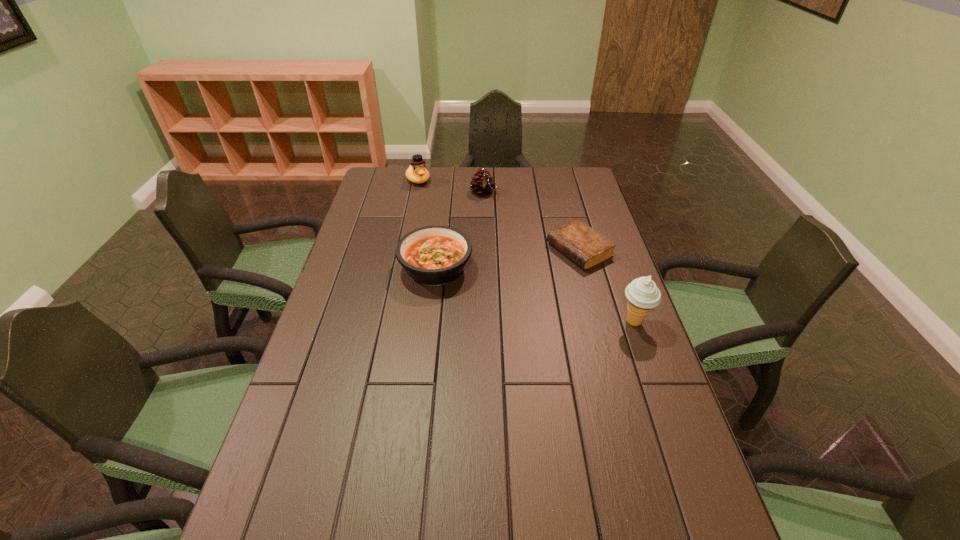
Image resolution: width=960 pixels, height=540 pixels. What are the coordinates of `icecream that is at the right edge` in the screenshot? It's located at (642, 293).

Locate an element on the screen. diary situated at the right edge is located at coordinates (586, 247).

Where is `object present at the far left corner`? object present at the far left corner is located at coordinates (416, 173).

Find the location of a particular element. The image size is (960, 540). vacant region at the far edge of the desktop is located at coordinates (462, 173).

Where is `vacant area at the left edge of the desktop`? vacant area at the left edge of the desktop is located at coordinates (290, 411).

I want to click on vacant space at the right edge, so click(642, 401).

This screenshot has width=960, height=540. What are the coordinates of `vacant space at the far left corner of the desktop` in the screenshot? It's located at (366, 191).

The height and width of the screenshot is (540, 960). What are the coordinates of `blank area at the far right corner` in the screenshot? It's located at (553, 188).

This screenshot has width=960, height=540. What are the coordinates of `vacant space that's between the pinecone and the duck` in the screenshot? It's located at (450, 186).

Where is `blank region between the shortest object and the pinecone`? Image resolution: width=960 pixels, height=540 pixels. blank region between the shortest object and the pinecone is located at coordinates (531, 221).